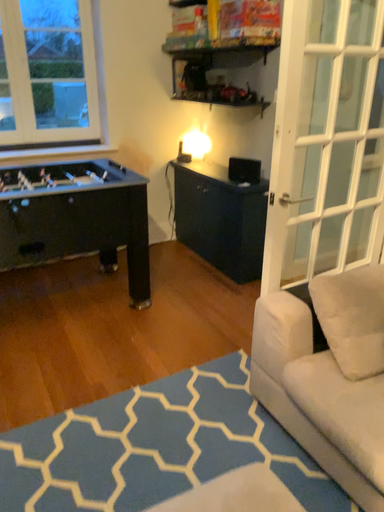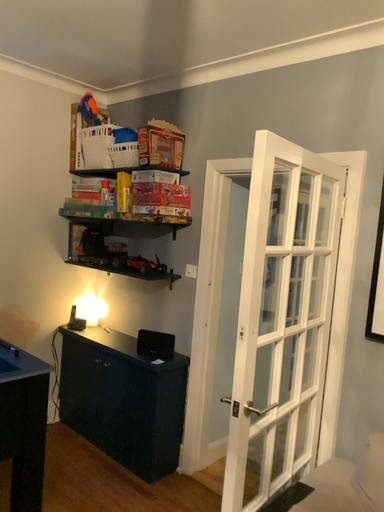
Question: Which way did the camera rotate in the video?

Choices:
 (A) rotated downward
 (B) rotated upward

Answer: (B)